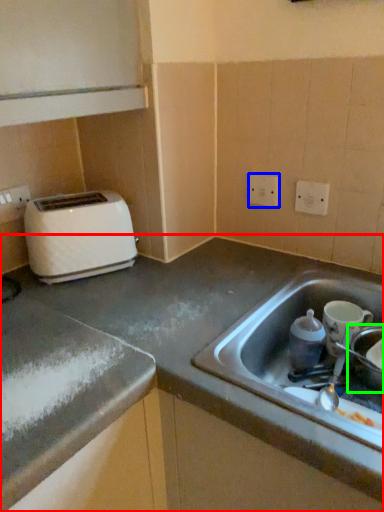
Question: Which object is positioned closest to countertop (highlighted by a red box)? Select from electric outlet (highlighted by a blue box) and appliance (highlighted by a green box).

Choices:
 (A) electric outlet
 (B) appliance

Answer: (B)